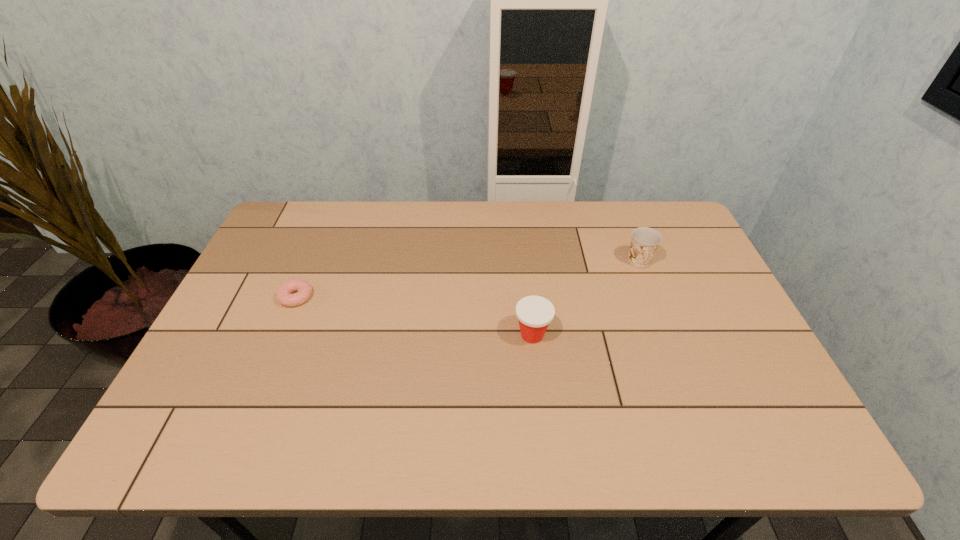
What are the coordinates of `free spot between the farther Dixie cup and the nearest object` in the screenshot? It's located at (586, 299).

This screenshot has height=540, width=960. Identify the location of vacant space that is in between the second object from left to right and the second nearest object. (414, 316).

Locate an element on the screen. Image resolution: width=960 pixels, height=540 pixels. vacant space that's between the left Dixie cup and the rightmost object is located at coordinates (586, 299).

This screenshot has width=960, height=540. What are the coordinates of `free space between the nearest object and the right Dixie cup` in the screenshot? It's located at (586, 299).

Find the location of a particular element. The image size is (960, 540). unoccupied area between the farthest object and the nearer Dixie cup is located at coordinates (586, 299).

In order to click on blank region between the right Dixie cup and the doughnut in this screenshot , I will do `click(468, 279)`.

Where is `free space between the doughnut and the farthest object`? The height and width of the screenshot is (540, 960). free space between the doughnut and the farthest object is located at coordinates (468, 279).

Identify which object is located as the nearest to the farther Dixie cup. Please provide its 2D coordinates. Your answer should be formatted as a tuple, i.e. [(x, y)], where the tuple contains the x and y coordinates of a point satisfying the conditions above.

[(534, 313)]

Choose which object is the nearest neighbor to the farther Dixie cup. Please provide its 2D coordinates. Your answer should be formatted as a tuple, i.e. [(x, y)], where the tuple contains the x and y coordinates of a point satisfying the conditions above.

[(534, 313)]

Where is `vacant space that satisfies the following two spatial constraints: 1. on the back side of the second nearest object; 2. on the left side of the farthest object`? vacant space that satisfies the following two spatial constraints: 1. on the back side of the second nearest object; 2. on the left side of the farthest object is located at coordinates (310, 262).